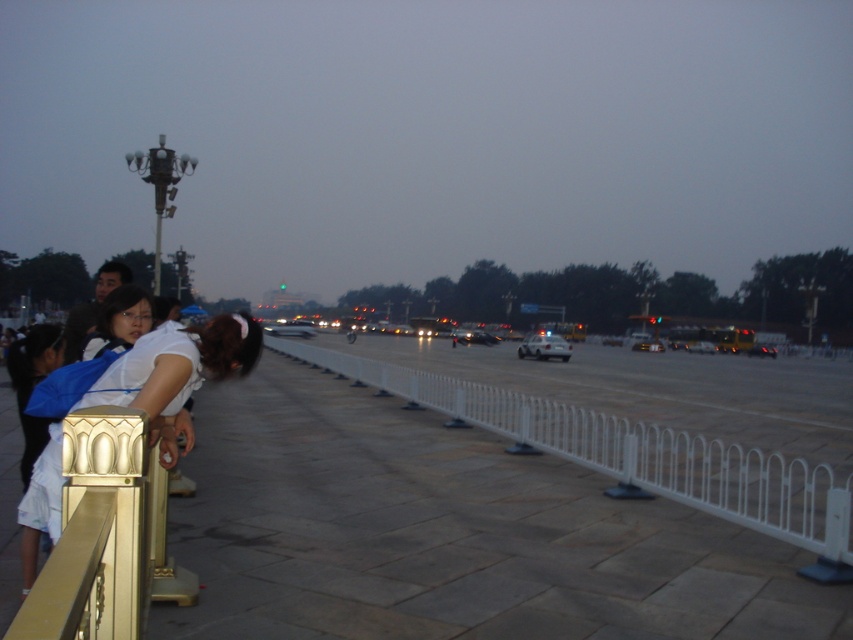
Question: Can you confirm if white metal fence at center is positioned to the left of white glossy car at center?

Choices:
 (A) yes
 (B) no

Answer: (A)

Question: Estimate the real-world distances between objects in this image. Which object is closer to the white glossy car at center?

Choices:
 (A) gold metallic railing at left
 (B) white metal fence at center

Answer: (B)

Question: In this image, where is white metal fence at center located relative to white glossy car at center?

Choices:
 (A) left
 (B) right

Answer: (A)

Question: Which object is farther from the camera taking this photo?

Choices:
 (A) gold metallic railing at left
 (B) white glossy car at center

Answer: (B)

Question: Is gold metallic railing at left above white glossy car at center?

Choices:
 (A) no
 (B) yes

Answer: (B)

Question: Which point is closer to the camera?

Choices:
 (A) (537, 340)
 (B) (233, 316)
 (C) (463, 392)

Answer: (B)